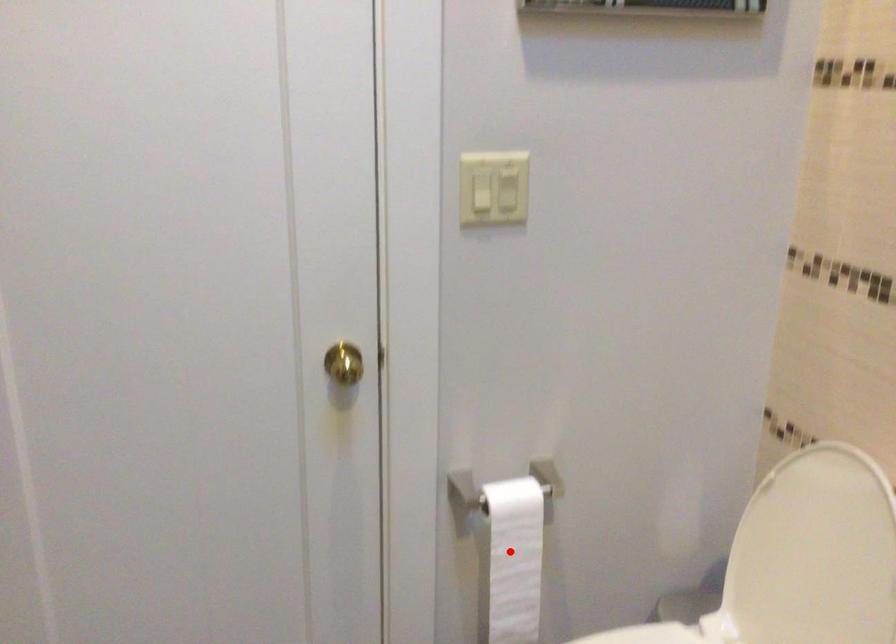
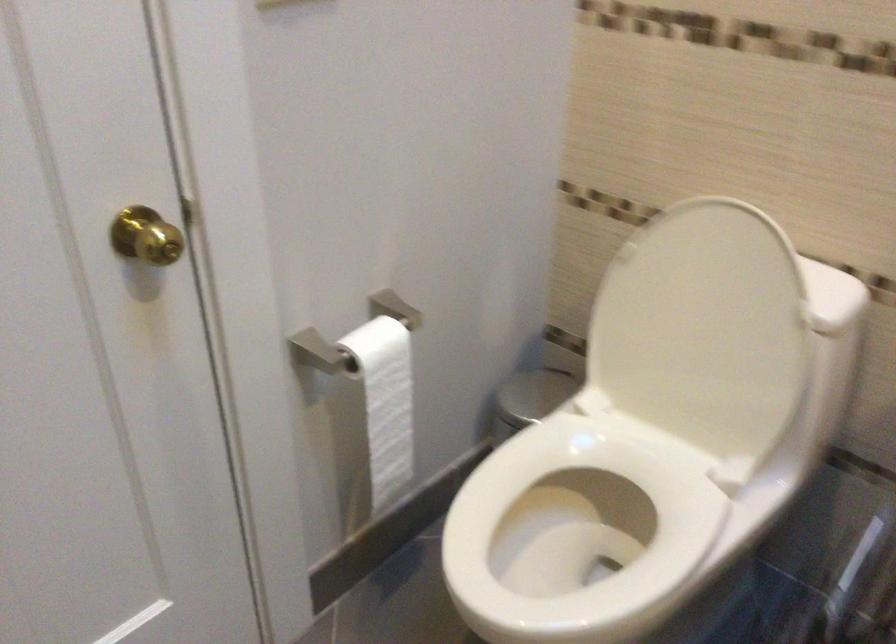
Find the pixel in the second image that matches the highlighted location in the first image.

(385, 402)